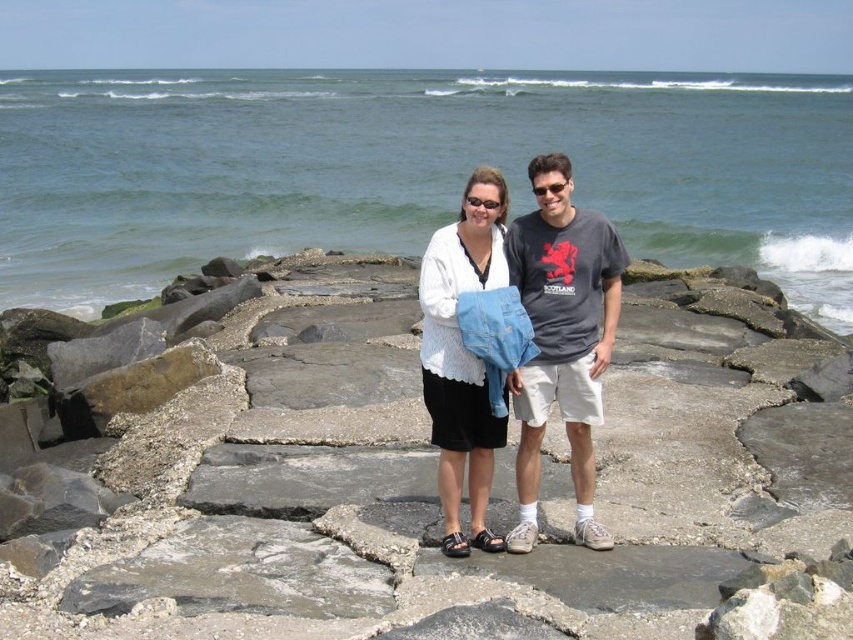
Does dark gray t-shirt at center have a lesser width compared to white textured sweater at center?

Incorrect, dark gray t-shirt at center's width is not less than white textured sweater at center's.

Image resolution: width=853 pixels, height=640 pixels. I want to click on dark gray t-shirt at center, so click(561, 337).

Who is shorter, gray concrete at center or blue water at center?

Standing shorter between the two is gray concrete at center.

Consider the image. Which is above, gray concrete at center or blue water at center?

blue water at center is higher up.

Who is more distant from viewer, (315, 621) or (444, 93)?

Point (444, 93)

Where is `gray concrete at center`? Image resolution: width=853 pixels, height=640 pixels. gray concrete at center is located at coordinates (434, 483).

Which is more to the left, blue water at center or white textured sweater at center?

white textured sweater at center

Does point (236, 150) come behind point (473, 221)?

Yes.

Which is behind, point (842, 138) or point (503, 228)?

Point (842, 138)

Image resolution: width=853 pixels, height=640 pixels. I want to click on blue water at center, so click(x=410, y=170).